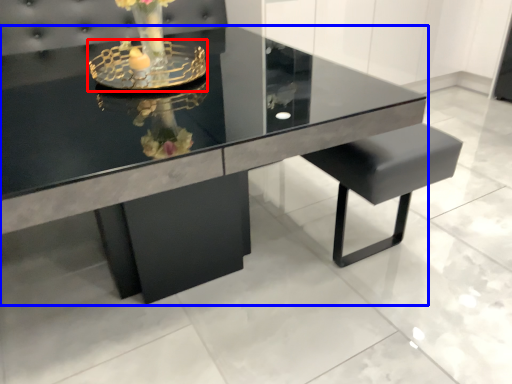
Question: Among these objects, which one is nearest to the camera, candle holder (highlighted by a red box) or table (highlighted by a blue box)?

Choices:
 (A) candle holder
 (B) table

Answer: (B)